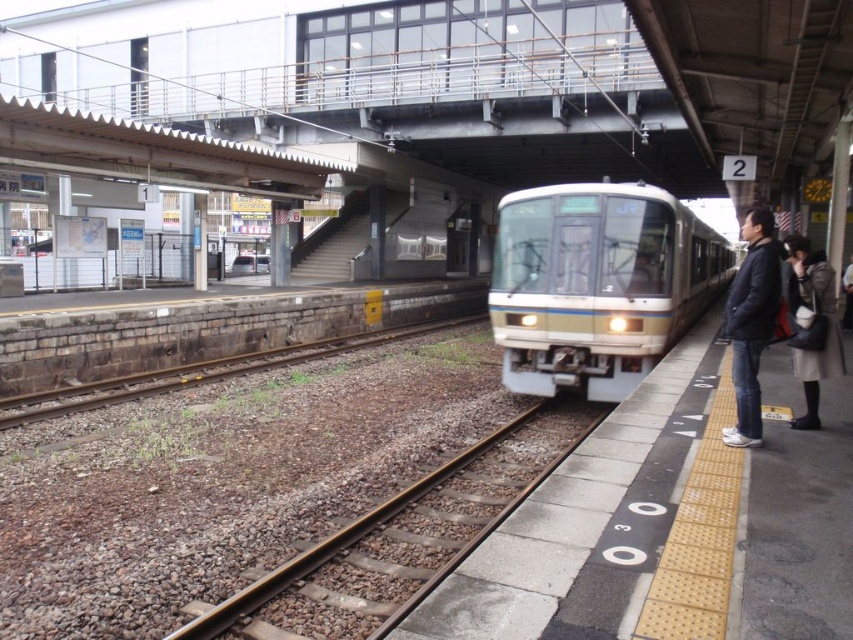
You are a passenger waiting at the train station platform. You notice the matte white train at center and the brown gravel train track at center. How far apart are these two objects from each other?

The matte white train at center is 35.97 feet away from the brown gravel train track at center.

You are waiting at the train station platform. You see a matte white train at center and a black matte jacket at right. Which object is taller?

The matte white train at center is not as tall as black matte jacket at right, so the black matte jacket at right is taller.

You are a passenger waiting at platform 2. You need to board the train that is approaching from the left. The platform has a yellow tactile paving strip along the edge. Where should you stand to safely wait for the train, considering the brown gravel train track at center?

You should stand away from the yellow tactile paving strip and behind the white platform boundary markings to stay clear of the brown gravel train track at center, ensuring safety while waiting for the train.